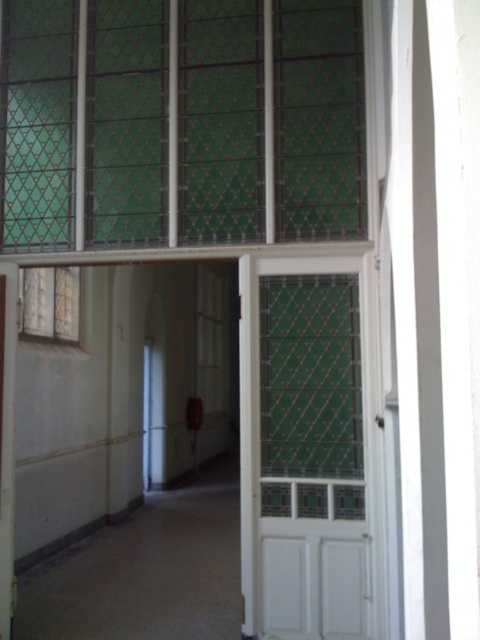
Which is in front, point (233, 108) or point (15, 330)?

Point (15, 330) is more forward.

Can you confirm if green textured glass at upper center is positioned to the right of white wooden door at center?

Correct, you'll find green textured glass at upper center to the right of white wooden door at center.

Who is more forward, (304, 234) or (12, 285)?

Point (304, 234)

The image size is (480, 640). Identify the location of green textured glass at upper center. (223, 122).

Who is more forward, (253, 342) or (4, 426)?

Positioned in front is point (253, 342).

Does white wood door at center come in front of white wooden door at center?

Yes, it is.

The height and width of the screenshot is (640, 480). What are the coordinates of `white wood door at center` in the screenshot? It's located at coord(309,448).

Identify the location of white wood door at center. (309, 448).

Does green textured glass at upper center appear on the left side of white wood door at center?

Correct, you'll find green textured glass at upper center to the left of white wood door at center.

Does green textured glass at upper center have a smaller size compared to white wood door at center?

Actually, green textured glass at upper center might be larger than white wood door at center.

The height and width of the screenshot is (640, 480). Describe the element at coordinates (223, 122) in the screenshot. I see `green textured glass at upper center` at that location.

Locate an element on the screen. The width and height of the screenshot is (480, 640). green textured glass at upper center is located at coordinates (223, 122).